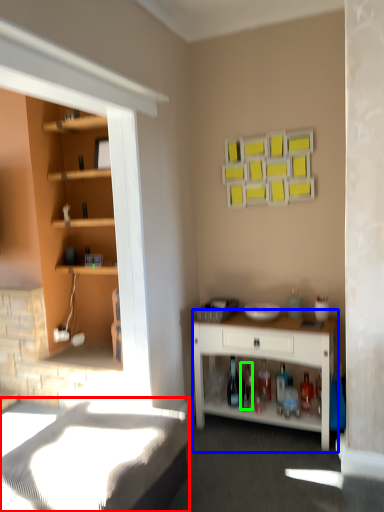
Question: Estimate the real-world distances between objects in this image. Which object is closer to bed frame (highlighted by a red box), desk (highlighted by a blue box) or bottle (highlighted by a green box)?

Choices:
 (A) desk
 (B) bottle

Answer: (A)